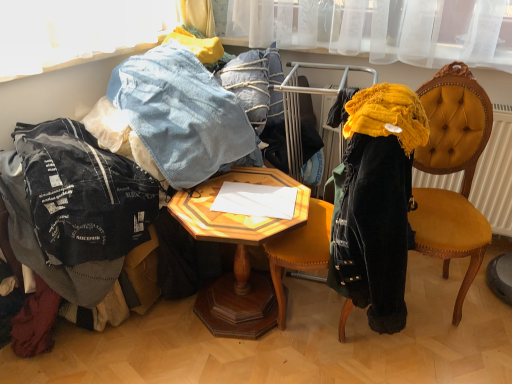
The image size is (512, 384). In order to click on free location in front of wooden hexagonal table at center in this screenshot , I will do coord(250,365).